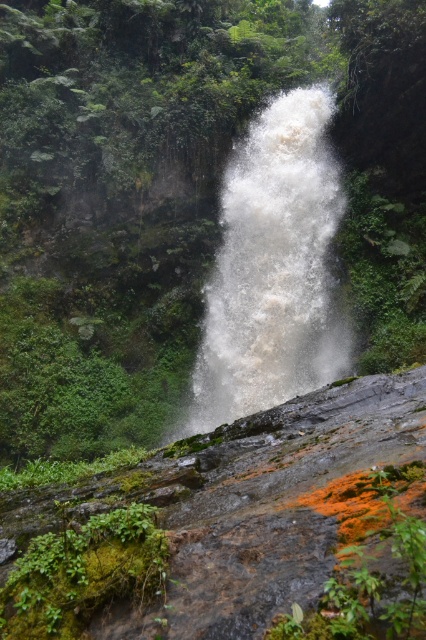
You are a hiker who wants to cross the rocky ledge to reach the waterfall. The white frothy water at center and the green mossy rock at lower left are in your path. Which object should you avoid stepping on to stay safe?

You should avoid stepping on the white frothy water at center because it is smaller than the green mossy rock at lower left, making it less stable and more slippery due to the splashing water.

You are a hiker who wants to cross the area near the waterfall. You see the white frothy water at center and the green mossy rock at lower left. Which object is higher up the cliff face?

The white frothy water at center is much taller than the green mossy rock at lower left, so the white frothy water at center is higher up the cliff face.